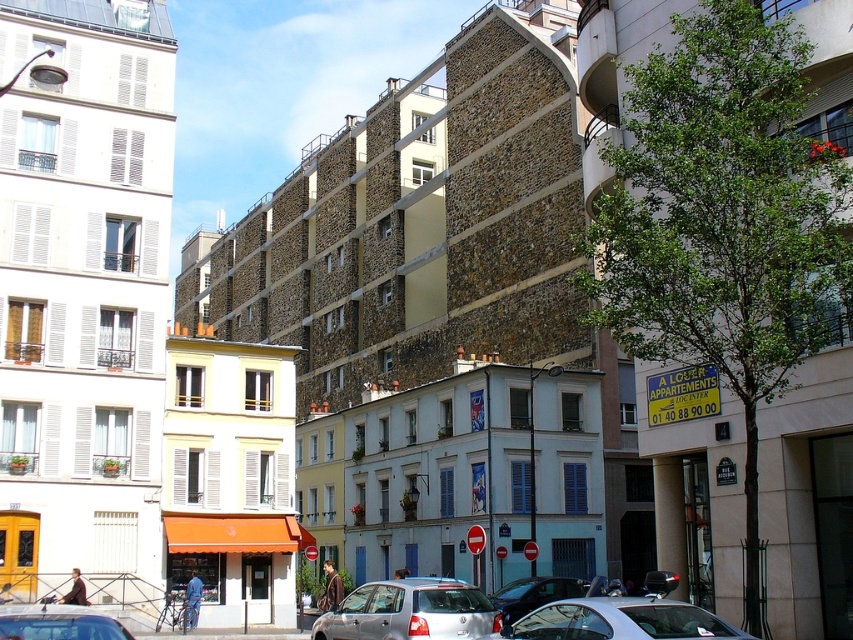
Question: Which of the following is the closest to the observer?

Choices:
 (A) (363, 589)
 (B) (567, 596)

Answer: (A)

Question: Which of the following is the farthest from the observer?

Choices:
 (A) metallic silver car at center
 (B) silver metallic car at center

Answer: (A)

Question: Does silver metallic car at center appear on the left side of metallic silver car at center?

Choices:
 (A) no
 (B) yes

Answer: (B)

Question: Which point is farther from the camera taking this photo?

Choices:
 (A) (425, 588)
 (B) (503, 612)
 (C) (16, 625)
 (D) (550, 616)

Answer: (B)

Question: Is silver metallic car at center further to the viewer compared to metallic silver car at center?

Choices:
 (A) no
 (B) yes

Answer: (A)

Question: In this image, where is silver metallic car at lower left located relative to metallic silver car at center?

Choices:
 (A) left
 (B) right

Answer: (A)